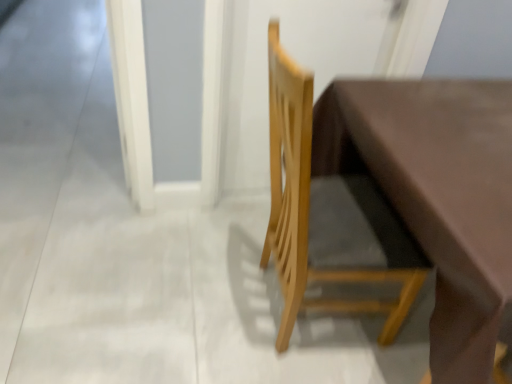
Question: From the image's perspective, is matte brown table at center under natural wood chair at center?

Choices:
 (A) yes
 (B) no

Answer: (A)

Question: Considering the relative sizes of matte brown table at center and natural wood chair at center in the image provided, is matte brown table at center bigger than natural wood chair at center?

Choices:
 (A) yes
 (B) no

Answer: (A)

Question: Is matte brown table at center thinner than natural wood chair at center?

Choices:
 (A) no
 (B) yes

Answer: (A)

Question: Does matte brown table at center have a lesser height compared to natural wood chair at center?

Choices:
 (A) yes
 (B) no

Answer: (A)

Question: Considering the relative sizes of matte brown table at center and natural wood chair at center in the image provided, is matte brown table at center wider than natural wood chair at center?

Choices:
 (A) no
 (B) yes

Answer: (B)

Question: From a real-world perspective, is matte brown table at center over natural wood chair at center?

Choices:
 (A) yes
 (B) no

Answer: (B)

Question: Considering the relative sizes of matte brown table at center and white glossy screen door at lower left in the image provided, is matte brown table at center taller than white glossy screen door at lower left?

Choices:
 (A) yes
 (B) no

Answer: (A)

Question: Is matte brown table at center aimed at white glossy screen door at lower left?

Choices:
 (A) no
 (B) yes

Answer: (A)

Question: Considering the relative sizes of matte brown table at center and white glossy screen door at lower left in the image provided, is matte brown table at center smaller than white glossy screen door at lower left?

Choices:
 (A) yes
 (B) no

Answer: (B)

Question: Does matte brown table at center have a larger size compared to white glossy screen door at lower left?

Choices:
 (A) no
 (B) yes

Answer: (B)

Question: Are matte brown table at center and white glossy screen door at lower left making contact?

Choices:
 (A) no
 (B) yes

Answer: (A)

Question: Is matte brown table at center positioned with its back to white glossy screen door at lower left?

Choices:
 (A) yes
 (B) no

Answer: (B)

Question: Can you confirm if white glossy screen door at lower left is wider than natural wood chair at center?

Choices:
 (A) no
 (B) yes

Answer: (B)